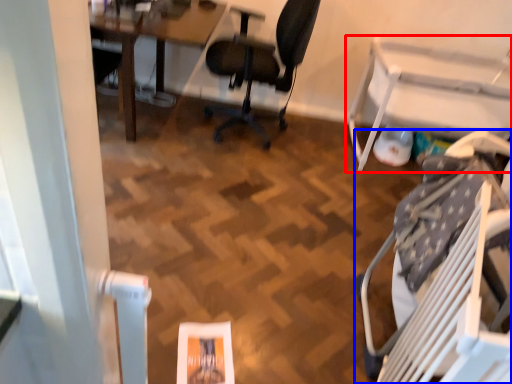
Question: Which object appears closest to the camera in this image, table (highlighted by a red box) or chair (highlighted by a blue box)?

Choices:
 (A) table
 (B) chair

Answer: (B)